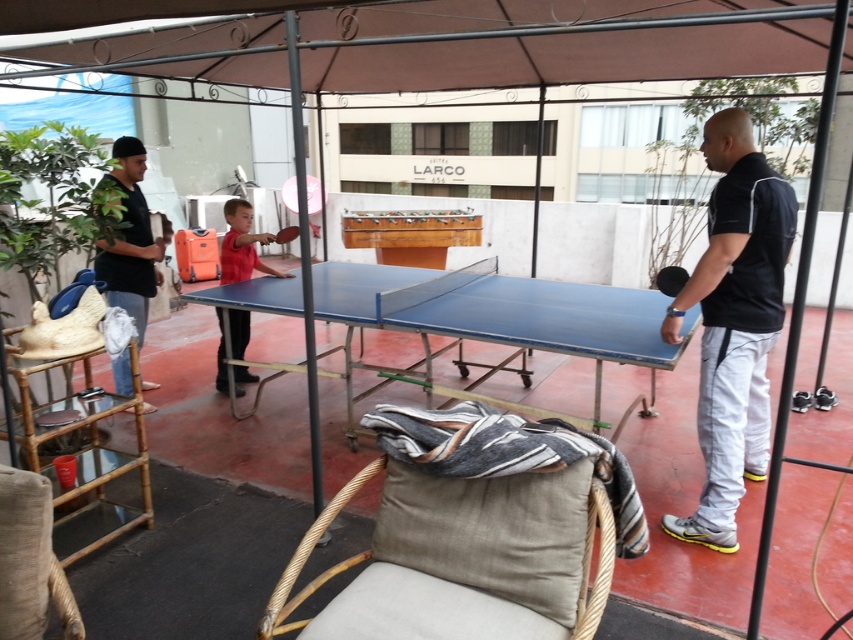
In the scene shown: You are standing at the ping pong table and want to place a new ball at point A and point B. If point A is point (35, 625) and point B is point (138, 321), which point is closer to you?

Point A is closer to you because it is in front of point B.

You are standing at the ping pong table and want to place a drink on the nearest available surface. Which object at point (30, 561) should you use?

The beige fabric chair at lower left located at point (30, 561) is the nearest available surface to place the drink.

You are a guest at the LARCO hotel and want to sit down near the ping pong table. There is a beige fabric chair at lower left and a black matte shirt at left. Which object is located closer to the ping pong table?

The beige fabric chair at lower left is positioned under the black matte shirt at left, meaning it is closer to the ping pong table.